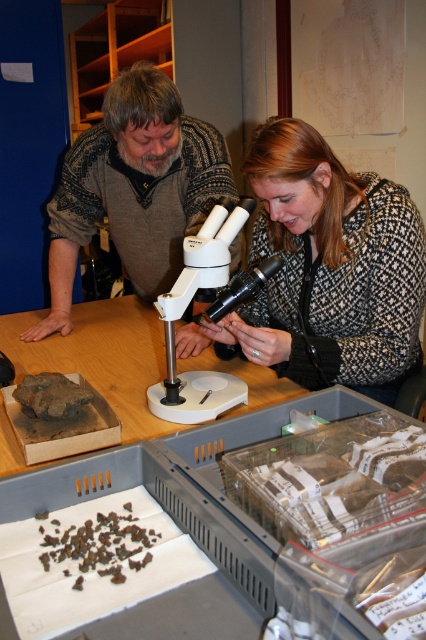
Which is more to the left, brown knitted sweater at center or white plastic microscope at center?

Positioned to the left is brown knitted sweater at center.

Is brown knitted sweater at center to the right of white plastic microscope at center from the viewer's perspective?

In fact, brown knitted sweater at center is to the left of white plastic microscope at center.

Does point (154, 140) lie behind point (236, 227)?

Yes, it is.

Locate an element on the screen. brown knitted sweater at center is located at coordinates (134, 188).

What do you see at coordinates (328, 269) in the screenshot? The width and height of the screenshot is (426, 640). I see `patterned fabric coat at center` at bounding box center [328, 269].

The width and height of the screenshot is (426, 640). What do you see at coordinates (328, 269) in the screenshot?
I see `patterned fabric coat at center` at bounding box center [328, 269].

At what (x,y) coordinates should I click in order to perform the action: click on patterned fabric coat at center. Please return your answer as a coordinate pair (x, y). Looking at the image, I should click on (328, 269).

Is brown knitted sweater at center below wooden table at center?

No.

Can you confirm if brown knitted sweater at center is shorter than wooden table at center?

No, brown knitted sweater at center is not shorter than wooden table at center.

Locate an element on the screen. brown knitted sweater at center is located at coordinates tap(134, 188).

This screenshot has width=426, height=640. Identify the location of brown knitted sweater at center. (134, 188).